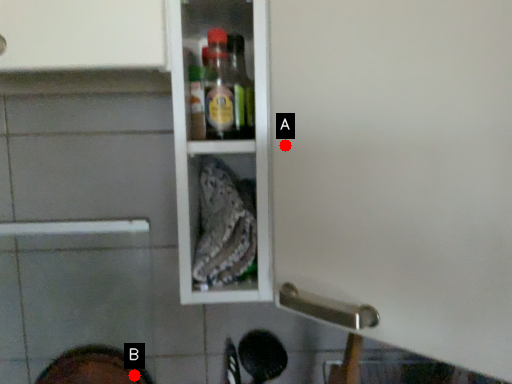
Question: Two points are circled on the image, labeled by A and B beside each circle. Which of the following is the closest to the observer?

Choices:
 (A) A is closer
 (B) B is closer

Answer: (A)